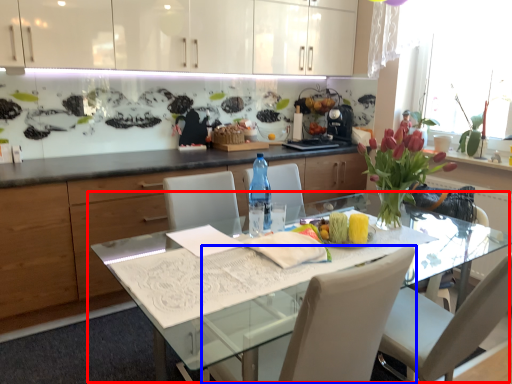
Question: Which of the following is the closest to the observer, kitchen & dining room table (highlighted by a red box) or chair (highlighted by a blue box)?

Choices:
 (A) kitchen & dining room table
 (B) chair

Answer: (B)